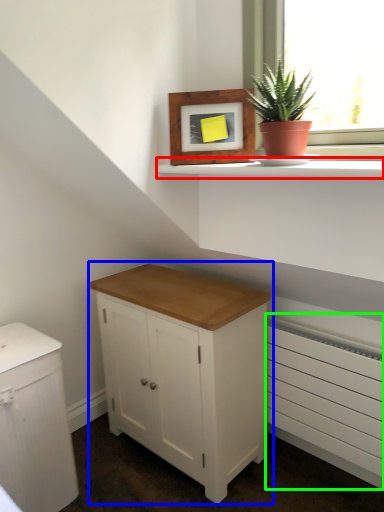
Question: Based on their relative distances, which object is farther from window sill (highlighted by a red box)? Choose from chest of drawers (highlighted by a blue box) and radiator (highlighted by a green box).

Choices:
 (A) chest of drawers
 (B) radiator

Answer: (B)